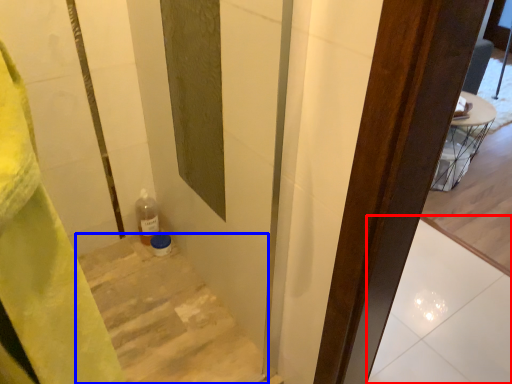
Question: Which point is closer to the camera, tile (highlighted by a red box) or stairs (highlighted by a blue box)?

Choices:
 (A) tile
 (B) stairs

Answer: (B)